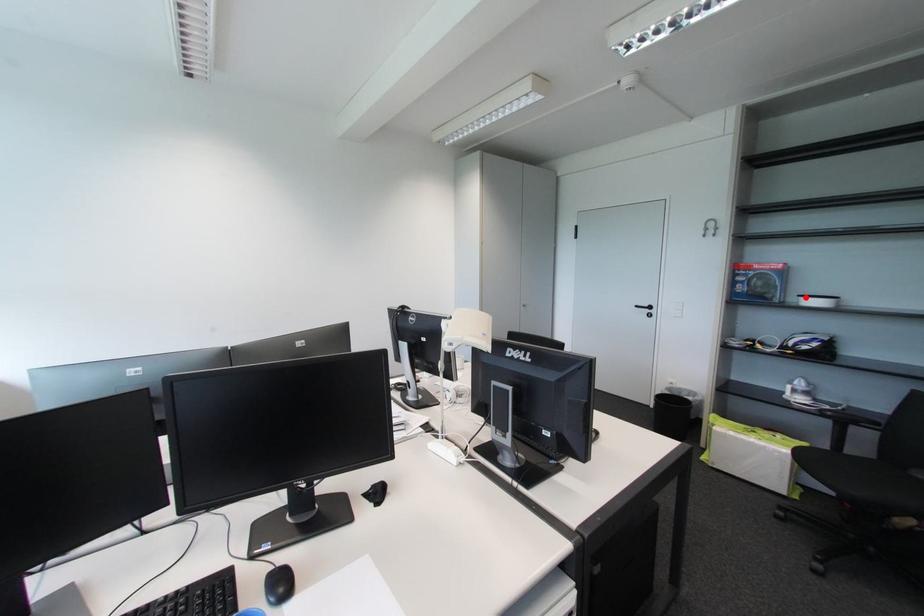
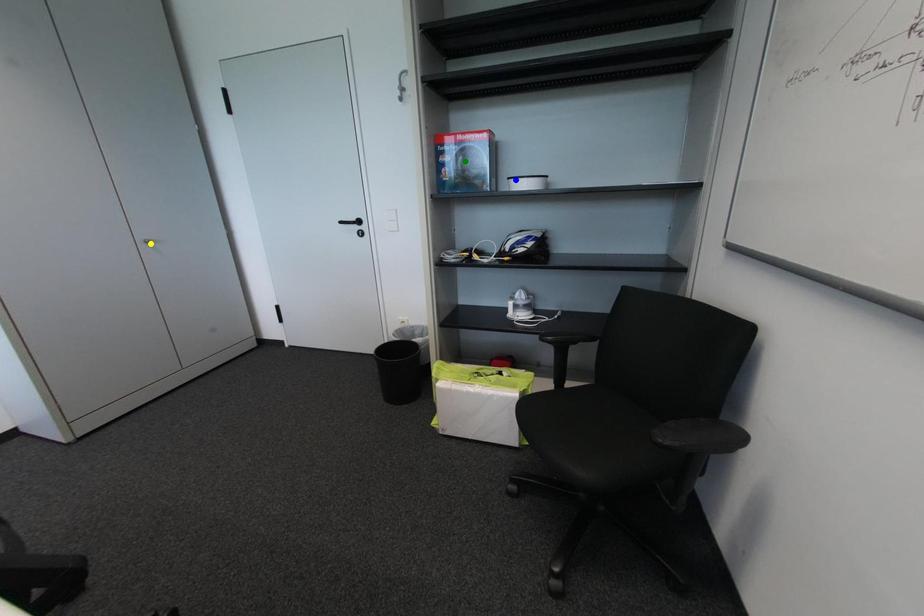
Question: I am providing you with two images of the same scene from different viewpoints. A red point is marked on the first image. You are given multiple points on the second image. Which mark in image 2 goes with the point in image 1?

Choices:
 (A) green point
 (B) yellow point
 (C) blue point

Answer: (C)